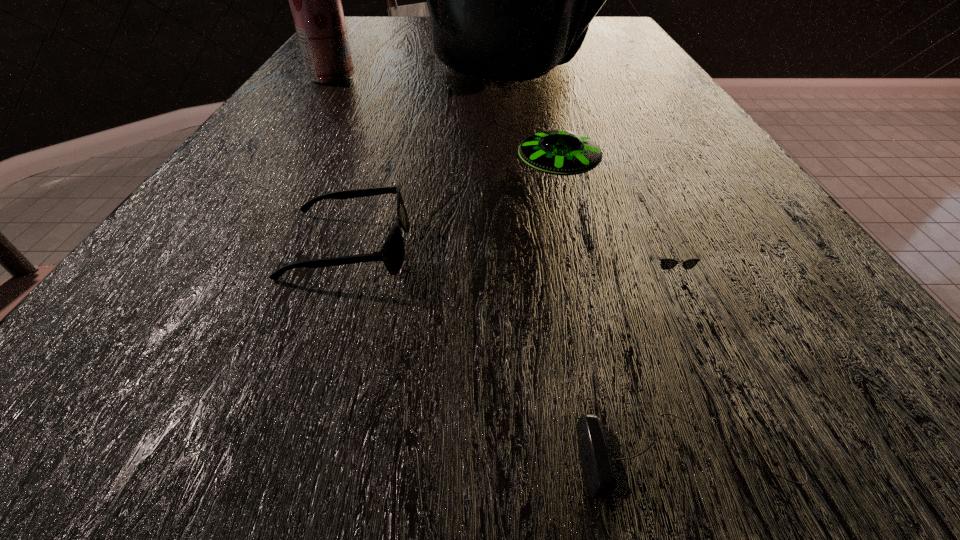
Identify the location of plastic bag at the right edge. This screenshot has height=540, width=960. (509, 0).

Where is `sunglasses at the right edge`? This screenshot has height=540, width=960. sunglasses at the right edge is located at coordinates (666, 263).

This screenshot has height=540, width=960. I want to click on webcam present at the right edge, so click(600, 454).

What are the coordinates of `object located in the far right corner section of the desktop` in the screenshot? It's located at (509, 0).

Locate an element on the screen. This screenshot has height=540, width=960. object positioned at the near right corner is located at coordinates (600, 454).

Find the location of a particular element. vacant space at the far edge of the desktop is located at coordinates (409, 24).

Locate an element on the screen. vacant region at the near edge of the desktop is located at coordinates (419, 449).

In the image, there is a desktop. Identify the location of vacant space at the left edge. (235, 201).

Where is `vacant area at the right edge`? The height and width of the screenshot is (540, 960). vacant area at the right edge is located at coordinates (680, 158).

Locate an element on the screen. The image size is (960, 540). vacant space at the far right corner of the desktop is located at coordinates (605, 25).